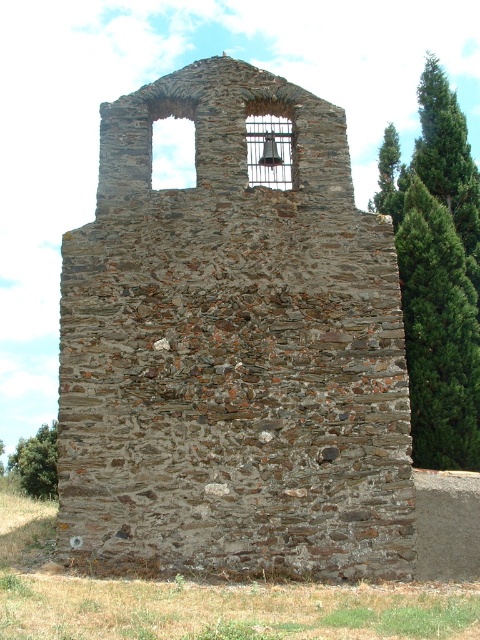
Measure the distance between brown stone bell tower at upper center and green leafy tree at right.

13.20 meters

Is brown stone bell tower at upper center smaller than green leafy tree at right?

Yes.

Between point (109, 480) and point (423, 458), which one is positioned in front?

Positioned in front is point (109, 480).

What are the coordinates of `brown stone bell tower at upper center` in the screenshot? It's located at pos(232,349).

Measure the distance between green leafy tree at right and metallic bell at upper center.

green leafy tree at right is 78.32 feet away from metallic bell at upper center.

In the scene shown: Who is higher up, green leafy tree at right or metallic bell at upper center?

green leafy tree at right is above.

Does point (429, 400) come closer to viewer compared to point (252, 177)?

No, (429, 400) is further to viewer.

This screenshot has width=480, height=640. In order to click on green leafy tree at right in this screenshot , I will do `click(437, 273)`.

Can you confirm if green leafy tree at lower left is positioned below green textured tree at right?

Yes.

Does point (25, 442) lie in front of point (385, 211)?

That is False.

Which is in front, point (55, 465) or point (387, 161)?

Point (55, 465) is more forward.

Locate an element on the screen. The height and width of the screenshot is (640, 480). green leafy tree at lower left is located at coordinates (36, 461).